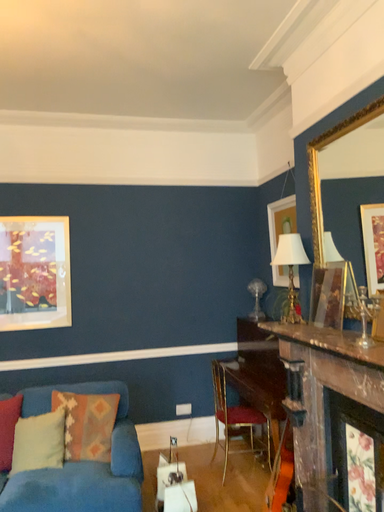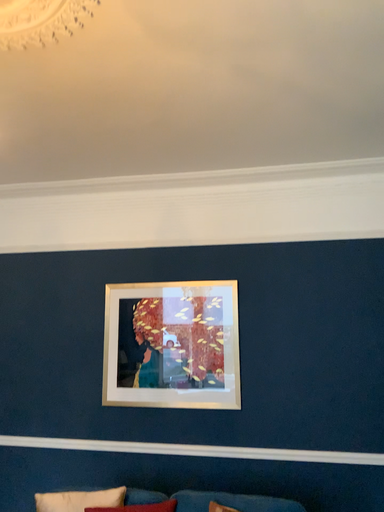
Question: How did the camera likely rotate when shooting the video?

Choices:
 (A) rotated right
 (B) rotated left

Answer: (B)